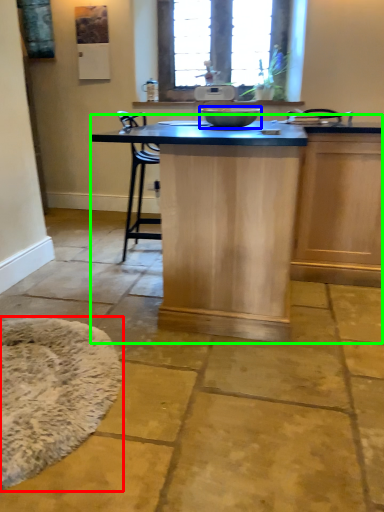
Question: Estimate the real-world distances between objects in this image. Which object is farther from mat (highlighted by a red box), mixing bowl (highlighted by a blue box) or table (highlighted by a green box)?

Choices:
 (A) mixing bowl
 (B) table

Answer: (A)